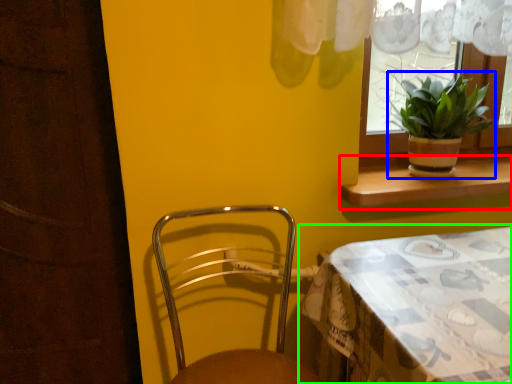
Question: Considering the real-world distances, which object is closest to window sill (highlighted by a red box)? houseplant (highlighted by a blue box) or table (highlighted by a green box).

Choices:
 (A) houseplant
 (B) table

Answer: (A)